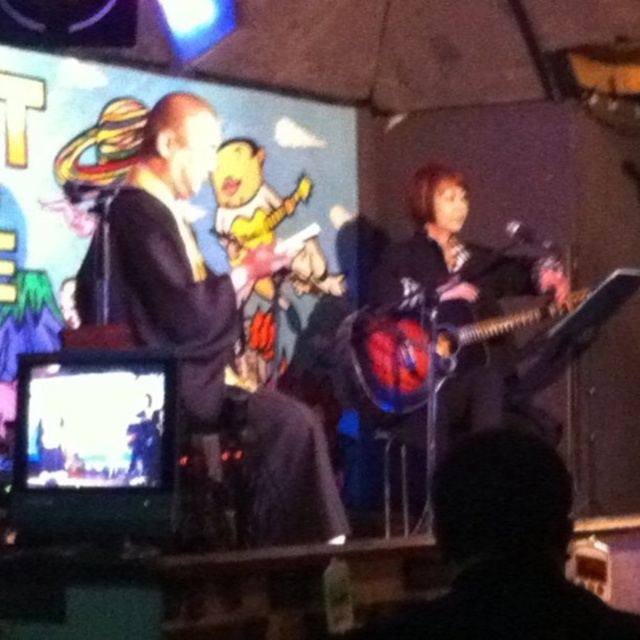
The width and height of the screenshot is (640, 640). I want to click on matte black guitar at center, so click(458, 257).

Does point (461, 355) come farther from viewer compared to point (476, 342)?

No, (461, 355) is in front of (476, 342).

I want to click on matte black guitar at center, so click(458, 257).

Which is above, black leather jacket at upper left or matte black guitar at center?

black leather jacket at upper left is above.

Based on the photo, can you confirm if black leather jacket at upper left is wider than matte black guitar at center?

Yes.

Find the location of a particular element. black leather jacket at upper left is located at coordinates (209, 321).

Is point (304, 465) closer to viewer compared to point (436, 348)?

Yes.

What do you see at coordinates (209, 321) in the screenshot? Image resolution: width=640 pixels, height=640 pixels. I see `black leather jacket at upper left` at bounding box center [209, 321].

Identify the location of black leather jacket at upper left. (209, 321).